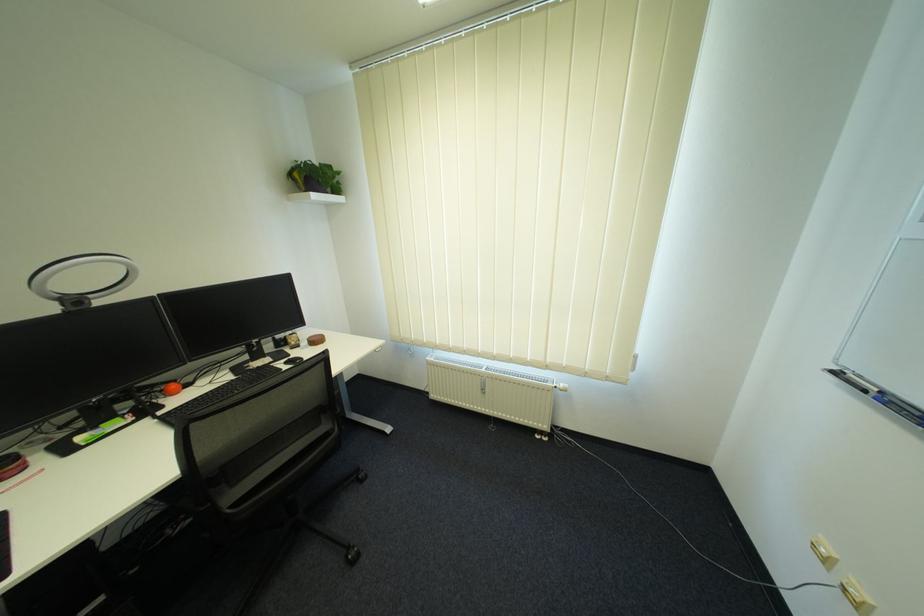
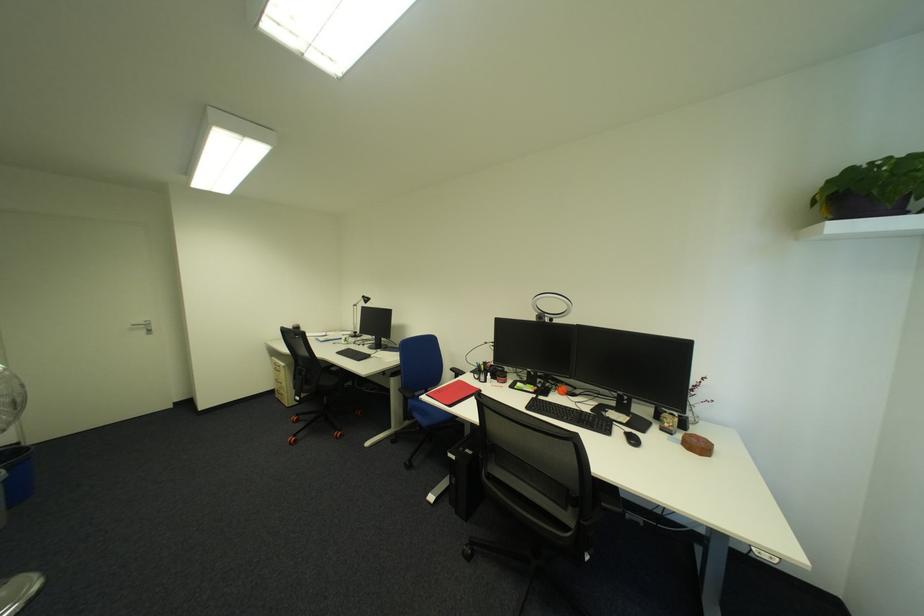
In the second image, find the point that corresponds to point 302,342 in the first image.

(677, 424)